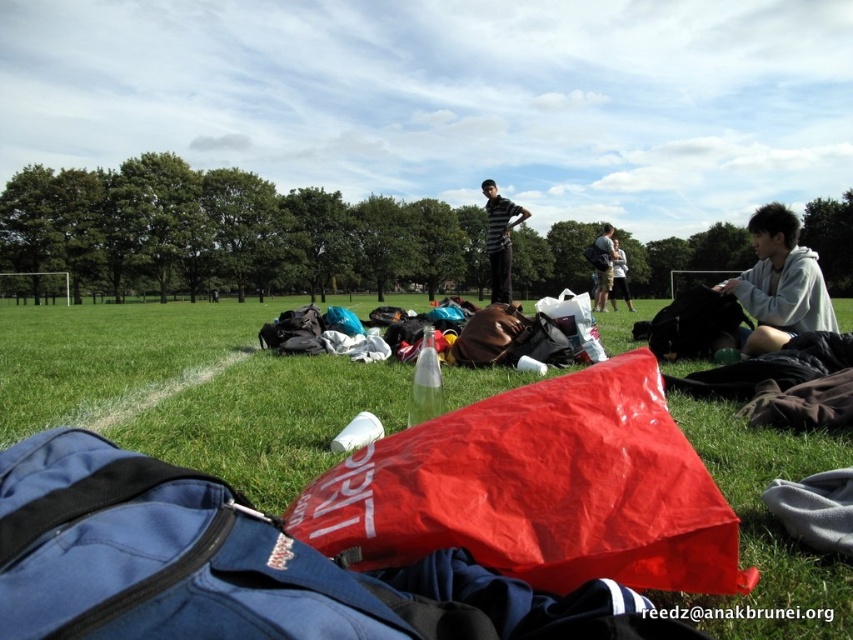
Question: Is green grass at center further to the viewer compared to striped fabric shirt at center?

Choices:
 (A) no
 (B) yes

Answer: (A)

Question: Can you confirm if green grass at center is positioned to the right of striped fabric shirt at center?

Choices:
 (A) yes
 (B) no

Answer: (B)

Question: Which of the following is the closest to the observer?

Choices:
 (A) (596, 292)
 (B) (271, 467)

Answer: (B)

Question: Considering the relative positions of sweatshirt at lower right and matte black backpack at center in the image provided, where is sweatshirt at lower right located with respect to matte black backpack at center?

Choices:
 (A) below
 (B) above

Answer: (A)

Question: Which point is farther to the camera?

Choices:
 (A) (775, 273)
 (B) (503, 216)
 (C) (618, 285)
 (D) (608, 273)

Answer: (C)

Question: Which object is the closest to the green grass at center?

Choices:
 (A) striped fabric shirt at center
 (B) sweatshirt at lower right
 (C) matte black backpack at center

Answer: (A)